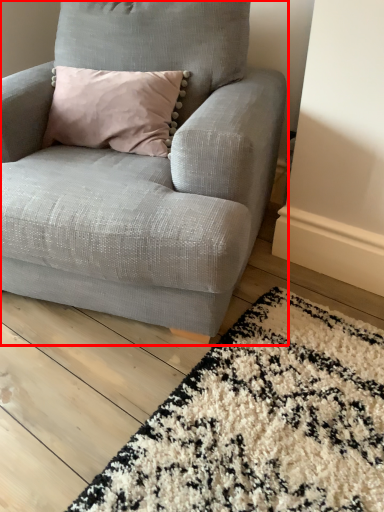
Question: From the image, what is the correct spatial relationship of chair (annotated by the red box) in relation to mat?

Choices:
 (A) left
 (B) right

Answer: (A)